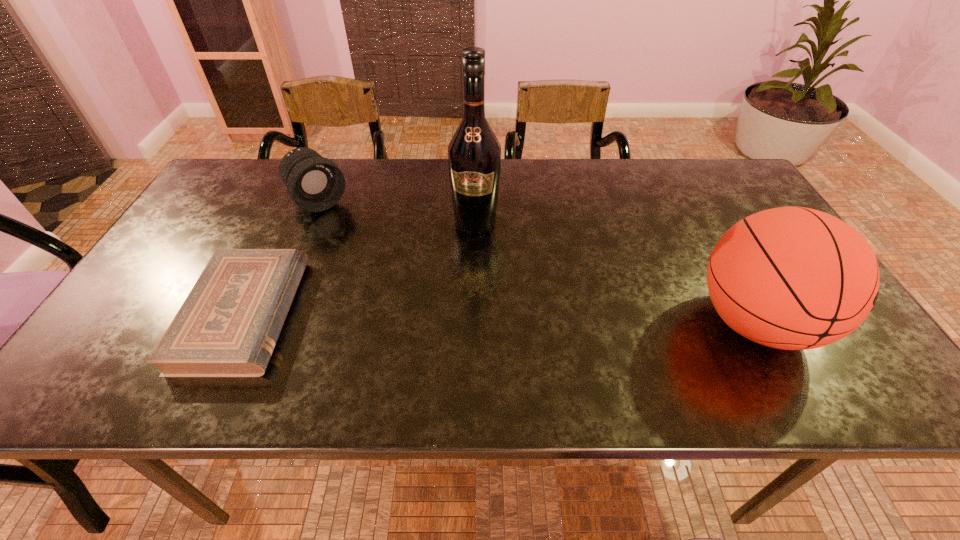
Find the location of a particular element. This screenshot has height=540, width=960. Bible is located at coordinates (228, 326).

The image size is (960, 540). I want to click on the third shortest object, so click(793, 278).

This screenshot has height=540, width=960. Find the location of `the rightmost object`. the rightmost object is located at coordinates (793, 278).

Where is `the third object from left to right`? The image size is (960, 540). the third object from left to right is located at coordinates (474, 153).

You are a GUI agent. You are given a task and a screenshot of the screen. Output one action in this format:
    pyautogui.click(x=<x>, y=<y>)
    Task: Click on the wine bottle
    
    Given the screenshot: What is the action you would take?
    pyautogui.click(x=474, y=153)

Locate an element on the screen. the second shortest object is located at coordinates (315, 183).

The image size is (960, 540). What are the coordinates of `blank space located 0.360m on the spine side of the Bible` in the screenshot? It's located at (454, 314).

Identify the location of vacant space located on the side with logo of the rightmost object. This screenshot has height=540, width=960. (841, 322).

This screenshot has width=960, height=540. I want to click on free location located 0.320m on the label of the tallest object, so click(459, 337).

You are a GUI agent. You are given a task and a screenshot of the screen. Output one action in this format:
    pyautogui.click(x=<x>, y=<y>)
    Task: Click on the vacant region located 0.200m on the label of the tallest object
    This screenshot has height=540, width=960.
    Given the screenshot: What is the action you would take?
    pyautogui.click(x=465, y=295)